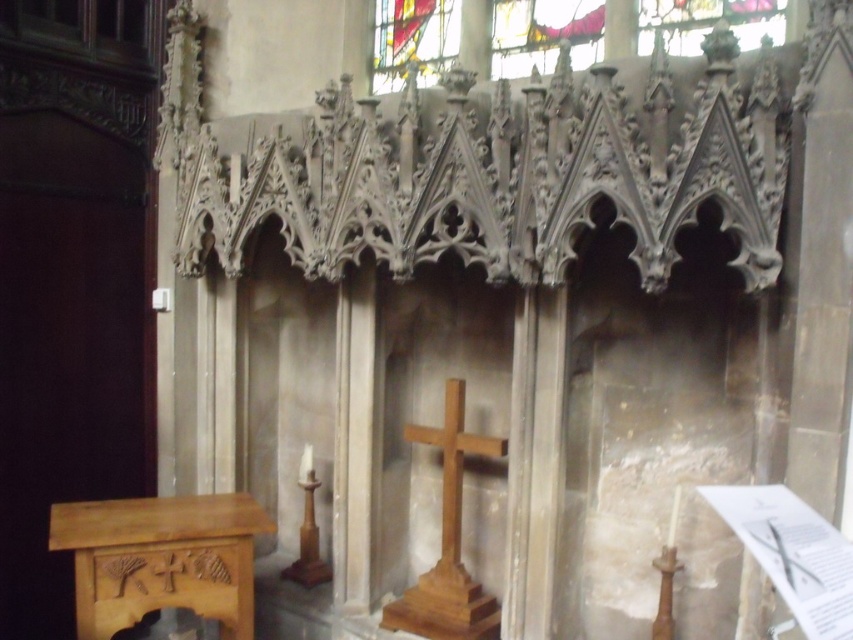
Question: Does stained glass window at upper center have a greater width compared to wooden cross at center?

Choices:
 (A) no
 (B) yes

Answer: (B)

Question: Does stained glass window at upper center appear over wooden cross at center?

Choices:
 (A) yes
 (B) no

Answer: (A)

Question: Considering the real-world distances, which object is farthest from the wooden cross at center?

Choices:
 (A) light brown polished wood altar at lower left
 (B) stained glass window at upper center

Answer: (B)

Question: Based on their relative distances, which object is nearer to the light brown polished wood altar at lower left?

Choices:
 (A) wooden cross at center
 (B) stained glass window at upper center

Answer: (A)

Question: In this image, where is light brown polished wood altar at lower left located relative to wooden cross at center?

Choices:
 (A) left
 (B) right

Answer: (A)

Question: Which object appears closest to the camera in this image?

Choices:
 (A) wooden cross at center
 (B) stained glass window at upper center
 (C) light brown polished wood altar at lower left

Answer: (C)